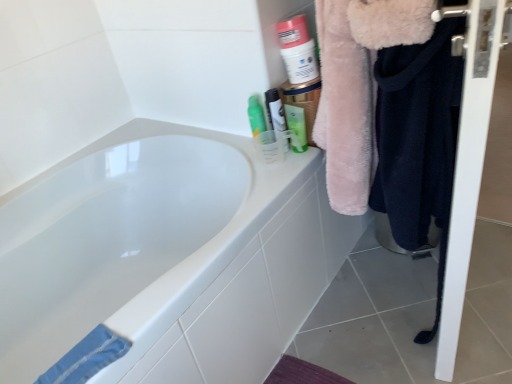
Question: Is white glossy screen door at right in front of or behind green matte tube at upper right, marked as the 1th mouthwash in a right-to-left arrangement, in the image?

Choices:
 (A) front
 (B) behind

Answer: (A)

Question: In terms of size, does white glossy screen door at right appear bigger or smaller than green matte tube at upper right, which ranks as the second mouthwash in left-to-right order?

Choices:
 (A) big
 (B) small

Answer: (A)

Question: Which of these objects is positioned closest to the faded denim towel at lower left?

Choices:
 (A) matte white container at upper right
 (B) dark blue fleece at right
 (C) fuzzy pink coat at right
 (D) green matte tube at upper right, marked as the 1th mouthwash in a right-to-left arrangement
 (E) translucent plastic cup at upper right, arranged as the 1th mouthwash when viewed from the left

Answer: (C)

Question: Considering the real-world distances, which object is closest to the white glossy bathtub at upper left?

Choices:
 (A) white glossy screen door at right
 (B) translucent plastic cup at upper right, the 2th mouthwash in the right-to-left sequence
 (C) dark blue fleece at right
 (D) matte white container at upper right
 (E) faded denim towel at lower left

Answer: (C)